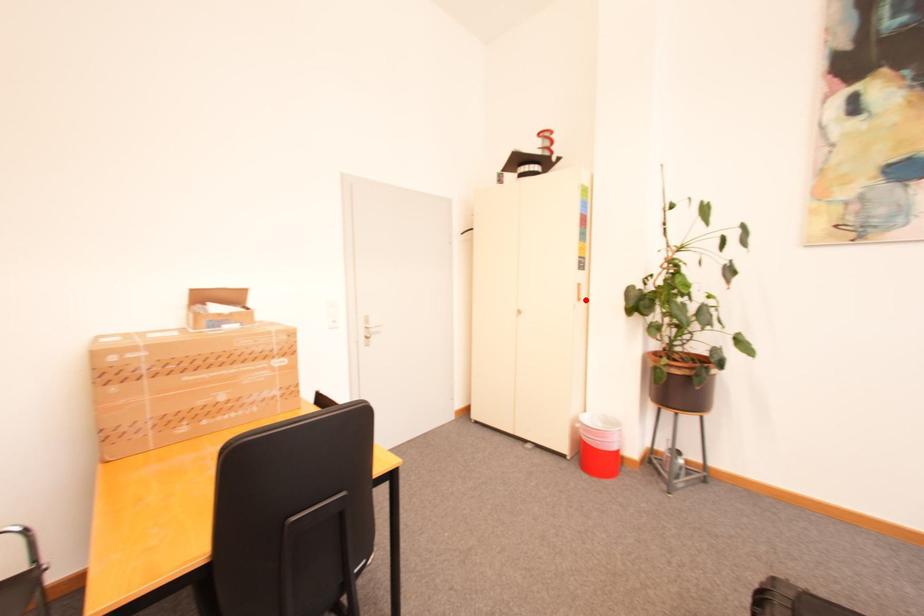
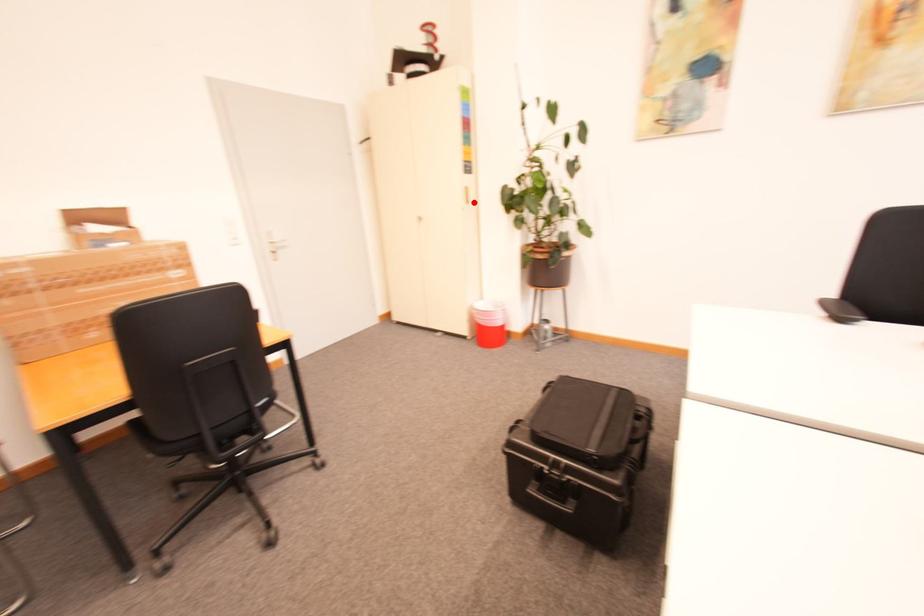
I am providing you with two images of the same scene from different viewpoints. A red point is marked on the first image and another point is marked on the second image. Does the point marked in image1 correspond to the same location as the one in image2?

Yes